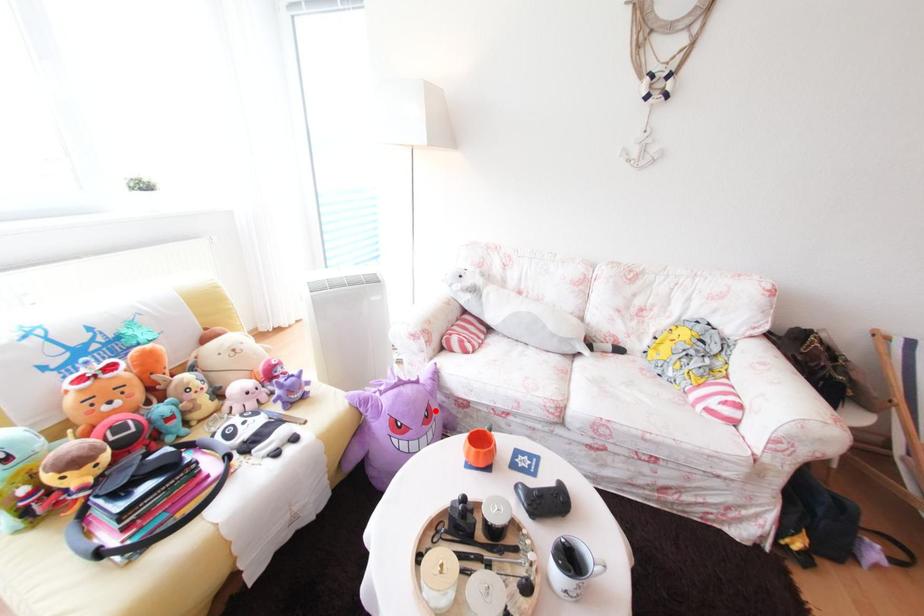
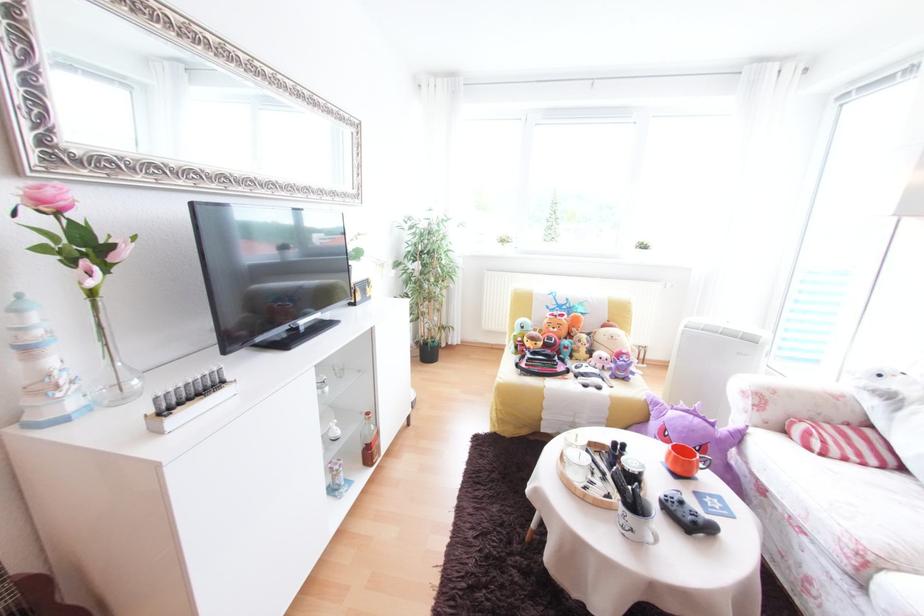
Question: I am providing you with two images of the same scene from different viewpoints. A red point is marked on the first image. Can you still see the location of the red point in image 2?

Choices:
 (A) Yes
 (B) No

Answer: (A)